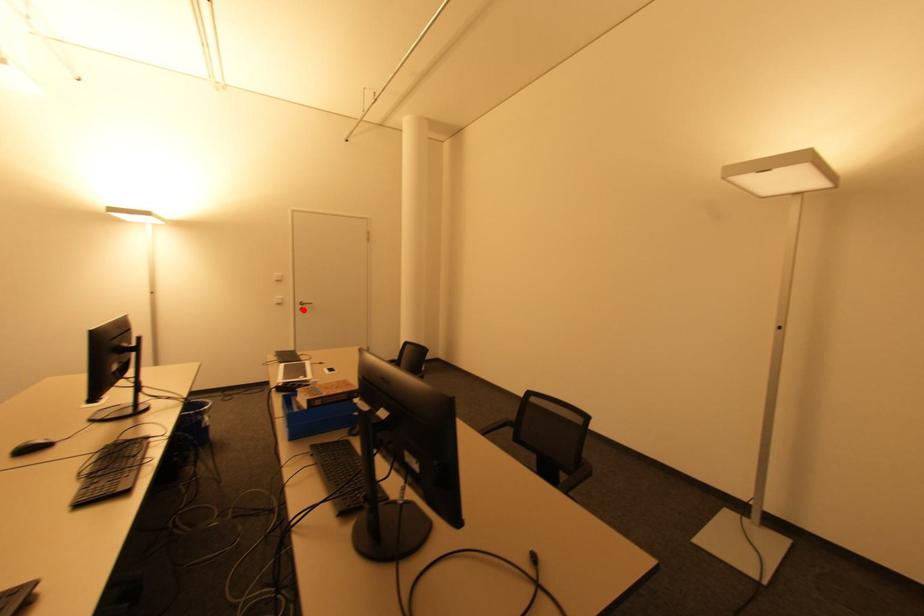
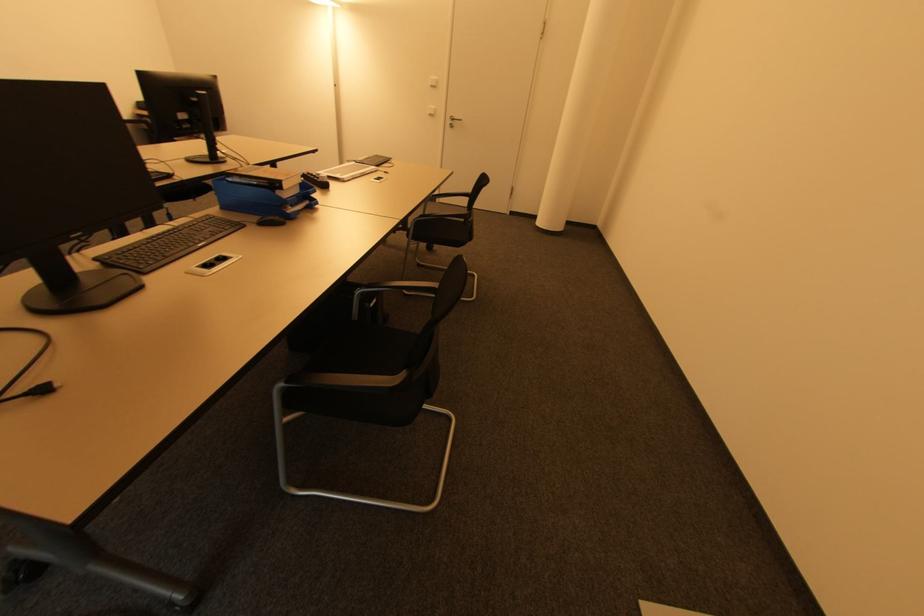
Where in the second image is the point corresponding to the highlighted location from the first image?

(454, 127)